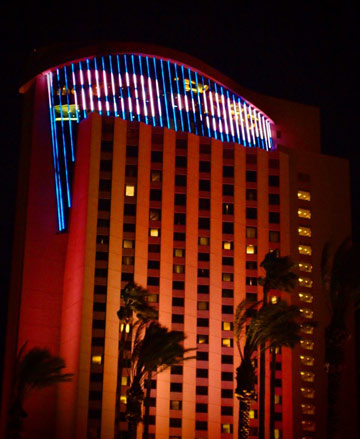
I want to click on wall, so click(77, 279).